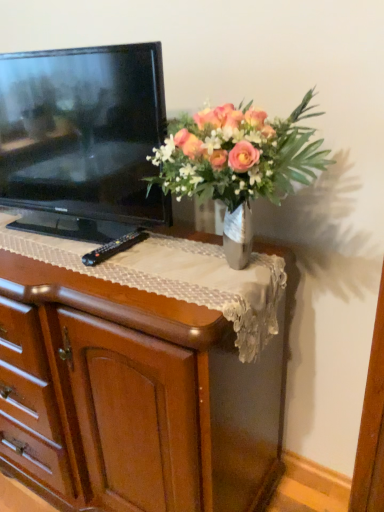
Question: Does black plastic remote at center lie behind wooden chest of drawers at center?

Choices:
 (A) yes
 (B) no

Answer: (A)

Question: From a real-world perspective, is black plastic remote at center on top of wooden chest of drawers at center?

Choices:
 (A) yes
 (B) no

Answer: (A)

Question: From the image's perspective, would you say black plastic remote at center is shown under wooden chest of drawers at center?

Choices:
 (A) no
 (B) yes

Answer: (A)

Question: Does black plastic remote at center appear on the right side of wooden chest of drawers at center?

Choices:
 (A) yes
 (B) no

Answer: (A)

Question: From a real-world perspective, is black plastic remote at center located beneath wooden chest of drawers at center?

Choices:
 (A) yes
 (B) no

Answer: (B)

Question: Is black plastic remote at center wider than wooden chest of drawers at center?

Choices:
 (A) no
 (B) yes

Answer: (A)

Question: Can you confirm if black glossy television at left is thinner than wooden chest of drawers at center?

Choices:
 (A) yes
 (B) no

Answer: (A)

Question: From a real-world perspective, is black glossy television at left on top of wooden chest of drawers at center?

Choices:
 (A) no
 (B) yes

Answer: (B)

Question: Is black glossy television at left smaller than wooden chest of drawers at center?

Choices:
 (A) yes
 (B) no

Answer: (A)

Question: Is black glossy television at left positioned far away from wooden chest of drawers at center?

Choices:
 (A) no
 (B) yes

Answer: (A)

Question: Is wooden chest of drawers at center at the back of black glossy television at left?

Choices:
 (A) no
 (B) yes

Answer: (A)

Question: Is black glossy television at left to the right of wooden chest of drawers at center from the viewer's perspective?

Choices:
 (A) no
 (B) yes

Answer: (B)

Question: Is wooden chest of drawers at center completely or partially outside of metallic vase at upper center?

Choices:
 (A) no
 (B) yes

Answer: (B)